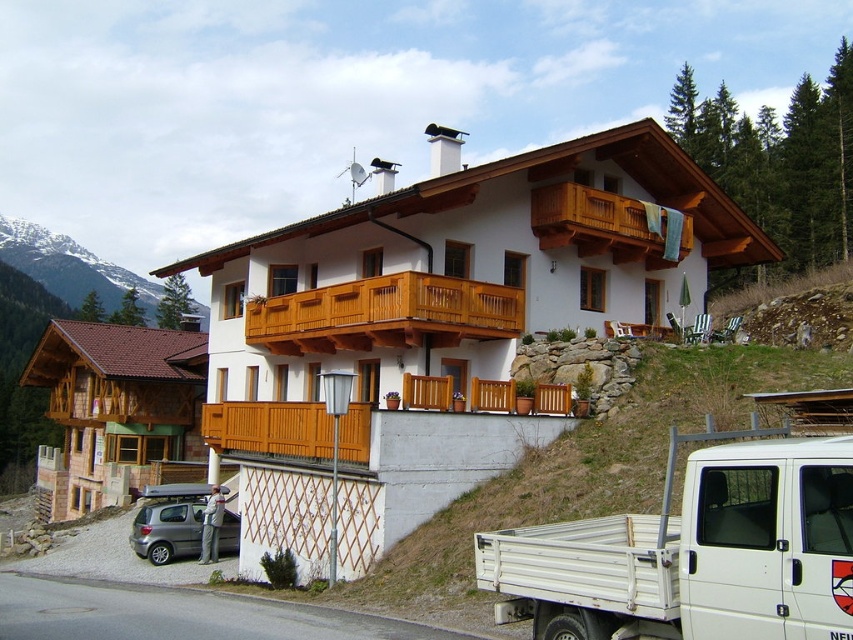
Question: Considering the relative positions of white metallic truck at lower right and metallic gray hatchback at lower left in the image provided, where is white metallic truck at lower right located with respect to metallic gray hatchback at lower left?

Choices:
 (A) above
 (B) below

Answer: (A)

Question: Is white metallic truck at lower right behind metallic gray hatchback at lower left?

Choices:
 (A) yes
 (B) no

Answer: (B)

Question: Considering the real-world distances, which object is closest to the wooden balcony at upper center?

Choices:
 (A) white metallic truck at lower right
 (B) white wooden chalet at center

Answer: (B)

Question: Does white wooden chalet at center appear under wooden balcony at upper center?

Choices:
 (A) no
 (B) yes

Answer: (B)

Question: Considering the real-world distances, which object is farthest from the wooden at center?

Choices:
 (A) white metallic truck at lower right
 (B) green grassy mountain at upper left
 (C) metallic gray hatchback at lower left

Answer: (B)

Question: Which of the following is the farthest from the observer?

Choices:
 (A) (511, 288)
 (B) (604, 264)
 (C) (97, 288)

Answer: (C)